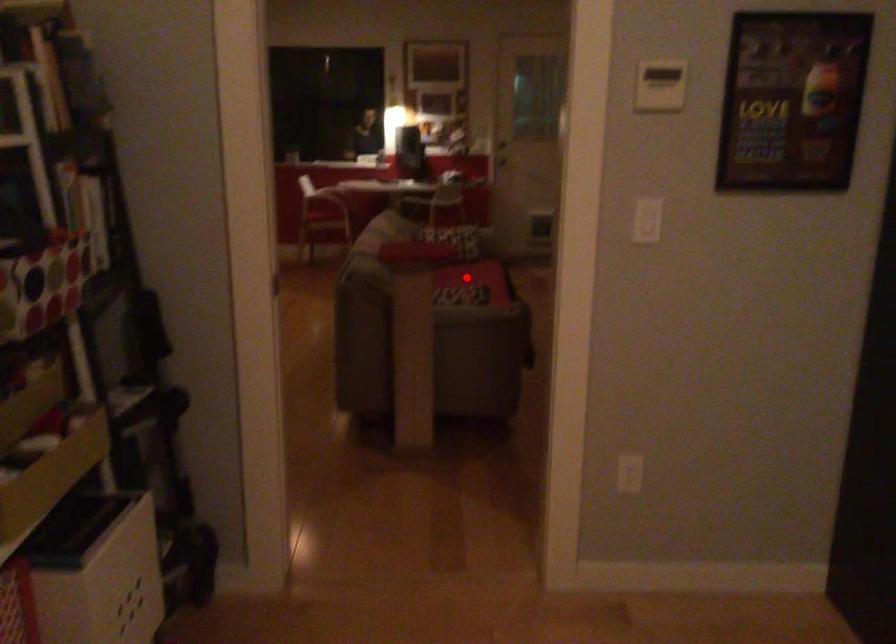
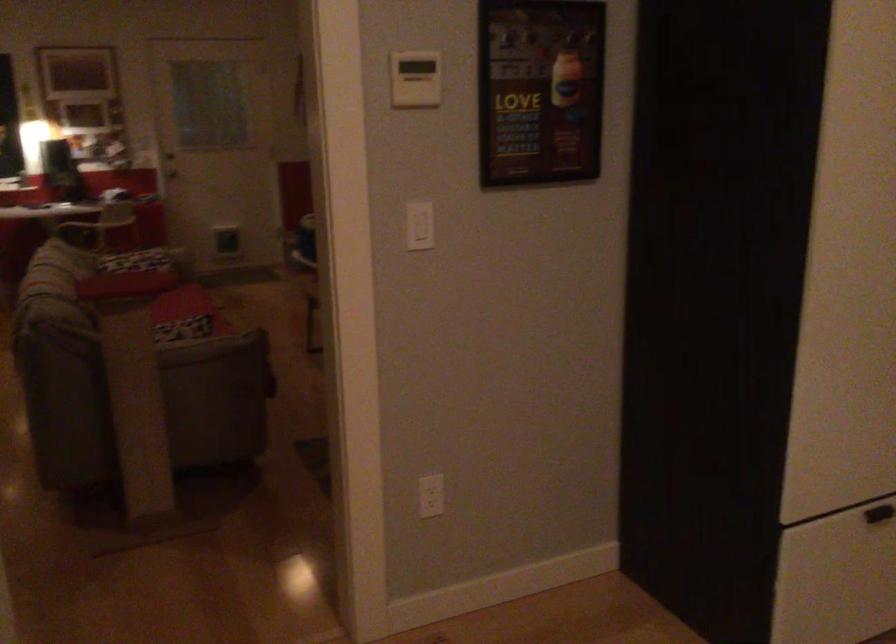
Locate, in the second image, the point that corresponds to the highlighted location in the first image.

(176, 308)